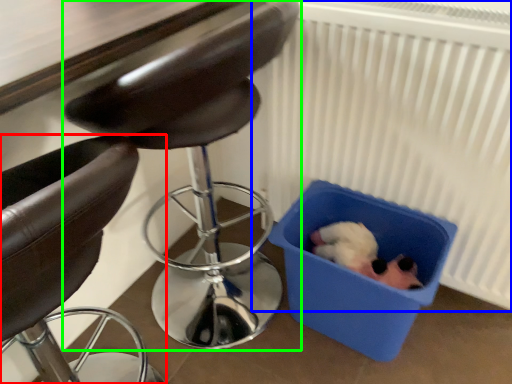
Question: Based on their relative distances, which object is farther from chair (highlighted by a red box)? Choose from radiator (highlighted by a blue box) and chair (highlighted by a green box).

Choices:
 (A) radiator
 (B) chair

Answer: (B)